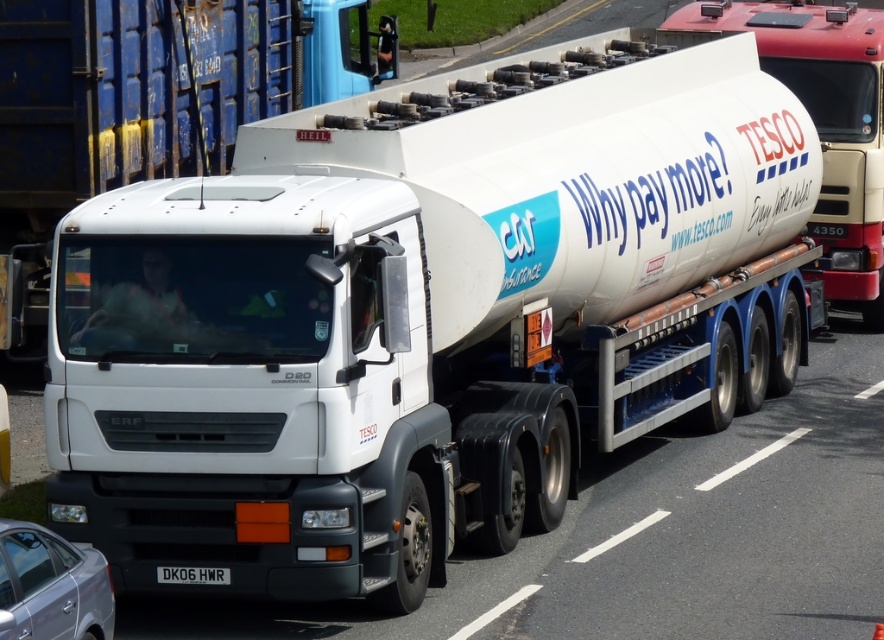
You are a pedestrian standing on the sidewalk. You see the white glossy tanker at center and the silver metallic sedan at lower left. Which vehicle is closer to you?

The white glossy tanker at center is closer to you because it is positioned further to the viewer than the silver metallic sedan at lower left.

You are a delivery driver who needs to park your silver metallic sedan at lower left behind the white glossy tanker at center. Can your sedan fit under the tanker without hitting the roof?

The white glossy tanker at center is taller than the silver metallic sedan at lower left, so the sedan can fit under the tanker without hitting the roof.